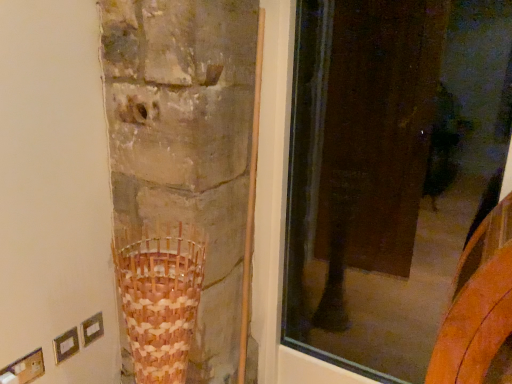
Question: Should I look upward or downward to see brown woven basket at lower center?

Choices:
 (A) up
 (B) down

Answer: (B)